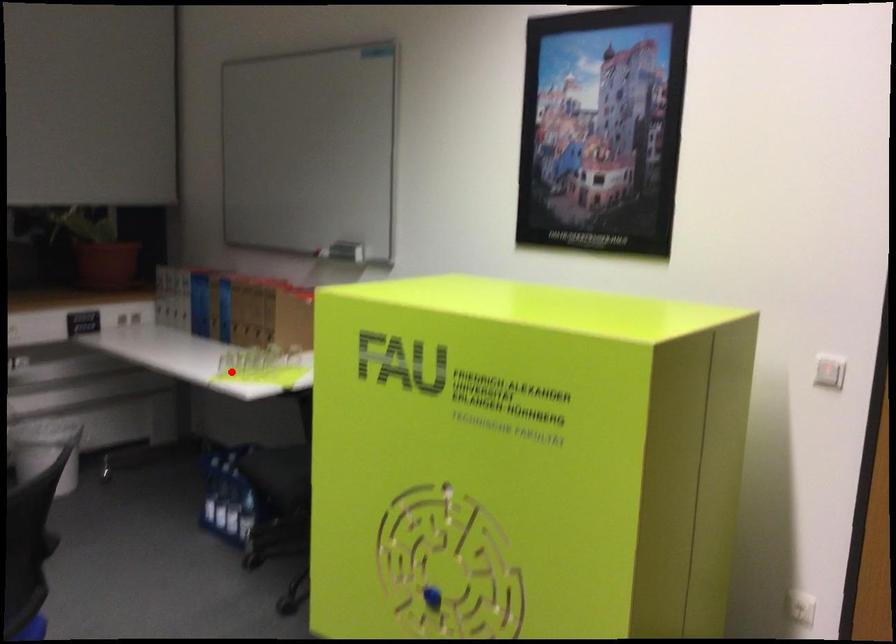
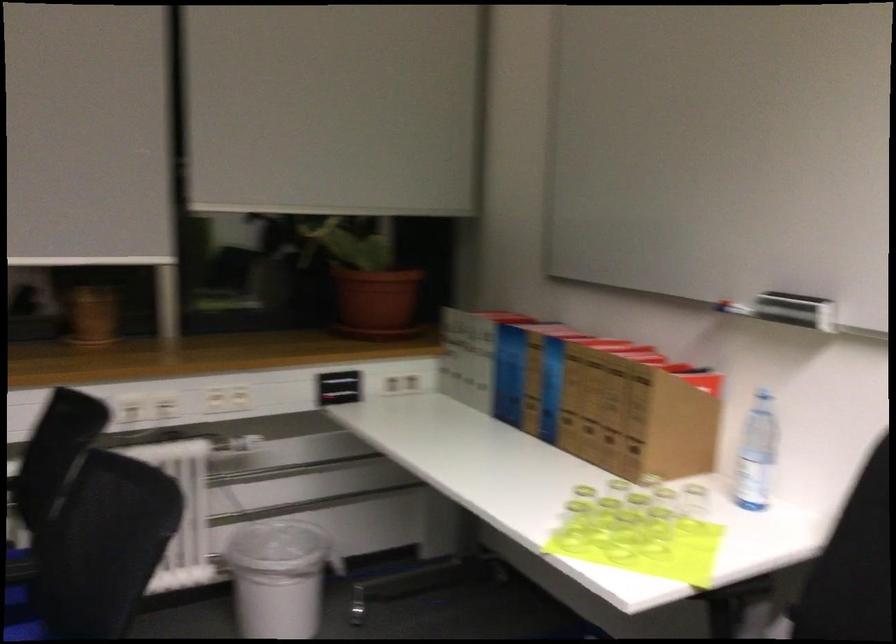
Where in the second image is the point corresponding to the highlighted location from the first image?

(573, 526)